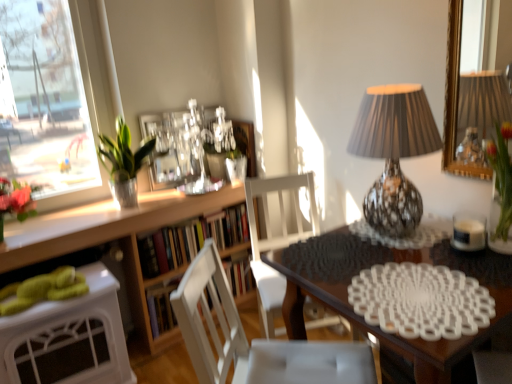
At what (x,y) coordinates should I click in order to perform the action: click on vacant space to the left of white glass candle at right. Please return your answer as a coordinate pair (x, y). The height and width of the screenshot is (384, 512). Looking at the image, I should click on (416, 249).